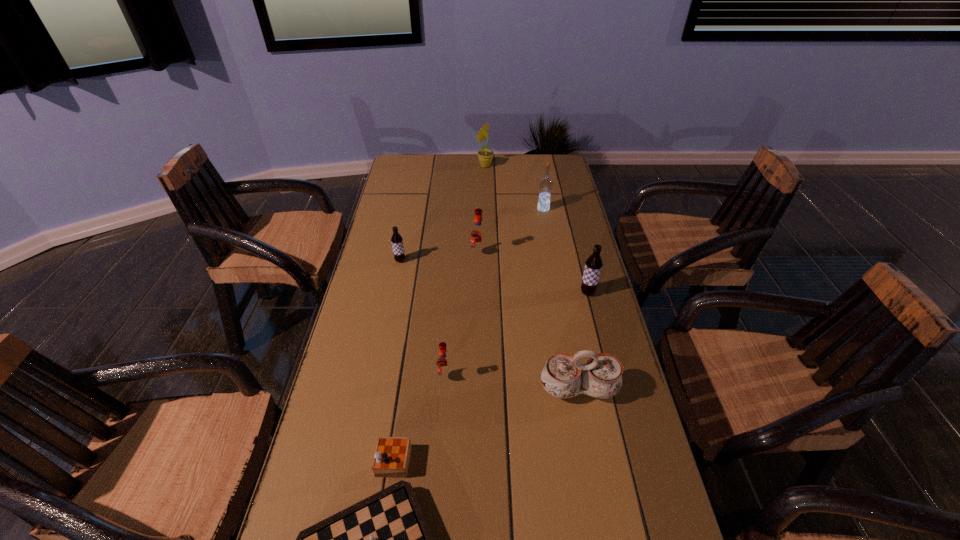
Find the location of `vacant space at the far right corner of the desktop`. vacant space at the far right corner of the desktop is located at coordinates (535, 170).

Where is `free spot between the bigger red root beer and the nearer red root beer`? Image resolution: width=960 pixels, height=540 pixels. free spot between the bigger red root beer and the nearer red root beer is located at coordinates (462, 316).

Find the location of a particular element. free space between the smaller red root beer and the rightmost root beer is located at coordinates 516,335.

Locate an element on the screen. vacant area that lies between the farther red root beer and the chinaware is located at coordinates (528, 322).

The image size is (960, 540). Find the location of `free space between the right red root beer and the leftmost root beer`. free space between the right red root beer and the leftmost root beer is located at coordinates (440, 258).

Image resolution: width=960 pixels, height=540 pixels. What are the coordinates of `vacant space that is in between the smaller red root beer and the sunflower` in the screenshot? It's located at (466, 272).

Locate an element on the screen. blank region between the farther brown root beer and the farthest object is located at coordinates (443, 213).

Locate an element on the screen. This screenshot has width=960, height=540. vacant area that lies between the second root beer from right to left and the second root beer from left to right is located at coordinates tap(462, 316).

Identify the location of vacant space in between the smaller red root beer and the sunflower. The height and width of the screenshot is (540, 960). (466, 272).

I want to click on free area in between the sunflower and the smaller brown root beer, so click(x=443, y=213).